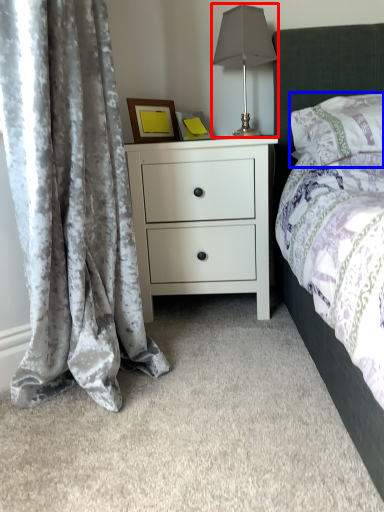
Question: Which of the following is the farthest to the observer, table lamp (highlighted by a red box) or pillow (highlighted by a blue box)?

Choices:
 (A) table lamp
 (B) pillow

Answer: (A)